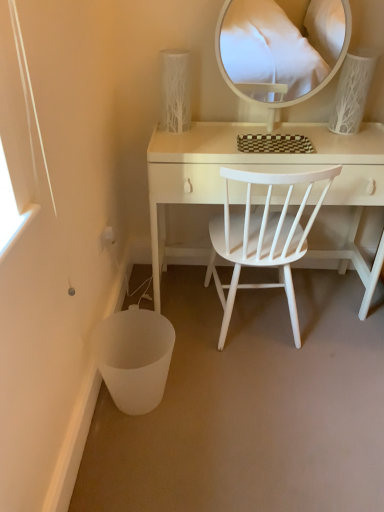
Question: Considering the positions of white textured vase at upper right, the 1th table lamp when ordered from right to left, and white glossy mirror at upper center in the image, is white textured vase at upper right, the 1th table lamp when ordered from right to left, wider or thinner than white glossy mirror at upper center?

Choices:
 (A) wide
 (B) thin

Answer: (A)

Question: Considering the positions of white textured vase at upper right, the second table lamp positioned from the left, and white glossy mirror at upper center in the image, is white textured vase at upper right, the second table lamp positioned from the left, taller or shorter than white glossy mirror at upper center?

Choices:
 (A) short
 (B) tall

Answer: (A)

Question: Considering the real-world distances, which object is farthest from the white glossy mirror at upper center?

Choices:
 (A) white textured vase at upper right, the second table lamp positioned from the left
 (B) white wood desk at center
 (C) white textured vase at upper center, which ranks as the 1th table lamp in left-to-right order
 (D) white wood chair at center
 (E) white matte trash bin/can at lower left

Answer: (E)

Question: Estimate the real-world distances between objects in this image. Which object is farther from the white wood chair at center?

Choices:
 (A) white wood desk at center
 (B) white matte trash bin/can at lower left
 (C) white glossy mirror at upper center
 (D) white textured vase at upper center, the 2th table lamp viewed from the right
 (E) white textured vase at upper right, the second table lamp positioned from the left

Answer: (C)